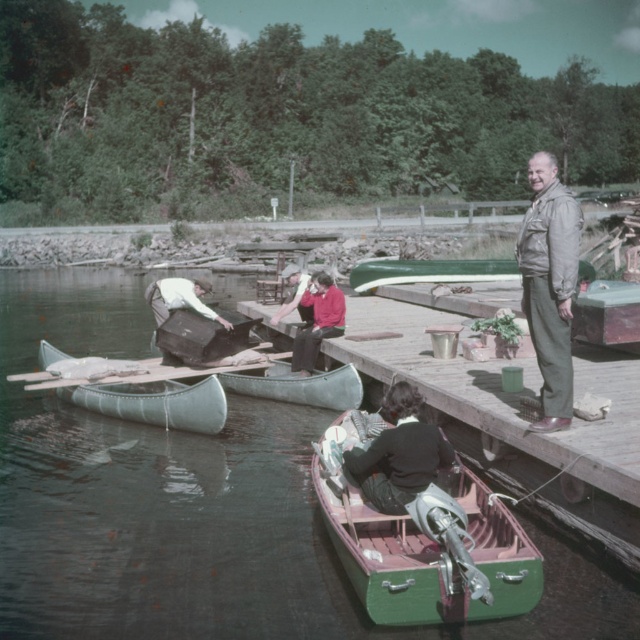
You are standing on the dock and want to move from point A to point B. Point A is at coordinates point (204, 419) and point B is at coordinates point (166, 301). Which point should you move towards first if you want to go towards the water?

Point A is in front of point B, so you should move towards point A first if you want to go towards the water.

You are planning to place the khaki fabric jacket at right on the deck of the green polished wood boat at lower center. Based on their widths, will the jacket fit entirely on the boat without hanging over the edges?

The green polished wood boat at lower center is wider than the khaki fabric jacket at right, so the jacket will fit entirely on the boat without hanging over the edges.

You are planning to store the khaki fabric jacket at right in the green polished wood boat at lower center. Based on the size of the boat and the jacket, will the jacket fit inside the boat?

The green polished wood boat at lower center is larger in size than the khaki fabric jacket at right, so the jacket will fit inside the boat.